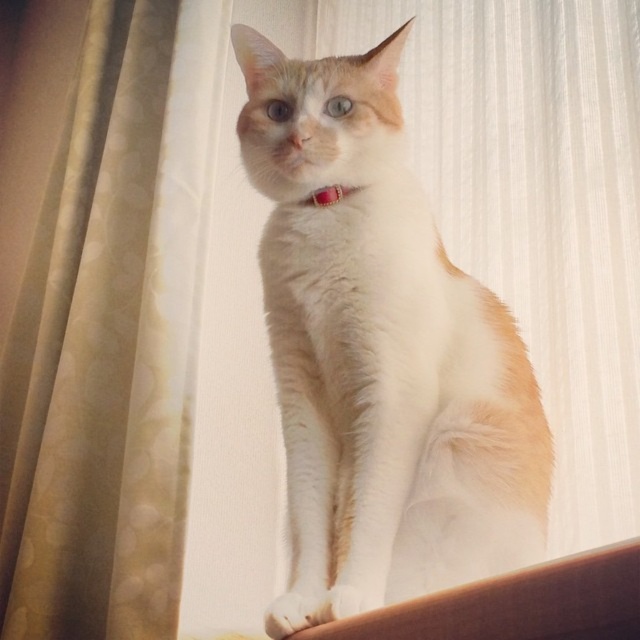
Question: Which is nearer to the white fur cat at center?

Choices:
 (A) rubber band at center
 (B) beige textured curtain at left

Answer: (A)

Question: Does beige textured curtain at left appear over rubber band at center?

Choices:
 (A) no
 (B) yes

Answer: (A)

Question: Does beige textured curtain at left appear under rubber band at center?

Choices:
 (A) no
 (B) yes

Answer: (B)

Question: Which of the following is the closest to the observer?

Choices:
 (A) beige textured curtain at left
 (B) rubber band at center
 (C) white fur cat at center

Answer: (C)

Question: Which object is closer to the camera taking this photo?

Choices:
 (A) white fur cat at center
 (B) rubber band at center
 (C) beige textured curtain at left

Answer: (A)

Question: Can you confirm if beige textured curtain at left is thinner than rubber band at center?

Choices:
 (A) yes
 (B) no

Answer: (B)